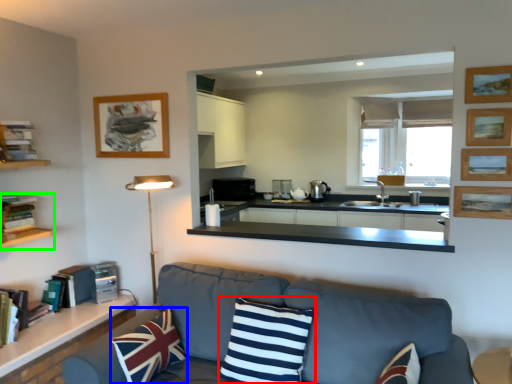
Question: Considering the real-world distances, which object is farthest from pillow (highlighted by a red box)? pillow (highlighted by a blue box) or shelf (highlighted by a green box)?

Choices:
 (A) pillow
 (B) shelf

Answer: (B)